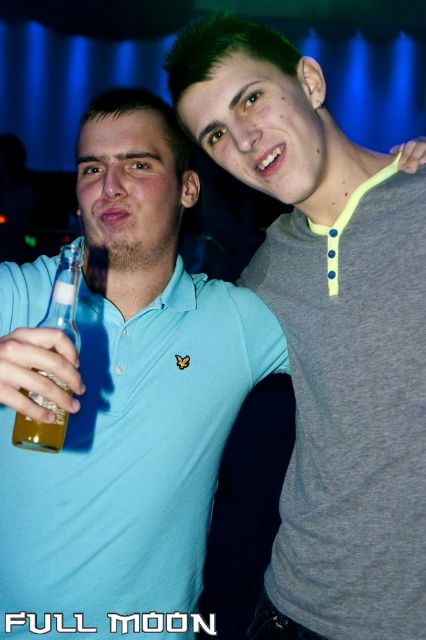
Question: Is gray matte shirt at upper right to the left of translucent glass bottle at left from the viewer's perspective?

Choices:
 (A) no
 (B) yes

Answer: (A)

Question: Which of the following is the farthest from the observer?

Choices:
 (A) gray matte shirt at upper right
 (B) translucent glass bottle at left

Answer: (A)

Question: Is the position of matte blue polo shirt at left less distant than that of translucent glass bottle at left?

Choices:
 (A) yes
 (B) no

Answer: (A)

Question: Estimate the real-world distances between objects in this image. Which object is closer to the translucent glass bottle at left?

Choices:
 (A) gray matte shirt at upper right
 (B) matte blue polo shirt at left

Answer: (B)

Question: Which of the following is the closest to the observer?

Choices:
 (A) (40, 371)
 (B) (123, 374)

Answer: (A)

Question: Can you confirm if gray matte shirt at upper right is positioned to the right of translucent glass bottle at left?

Choices:
 (A) yes
 (B) no

Answer: (A)